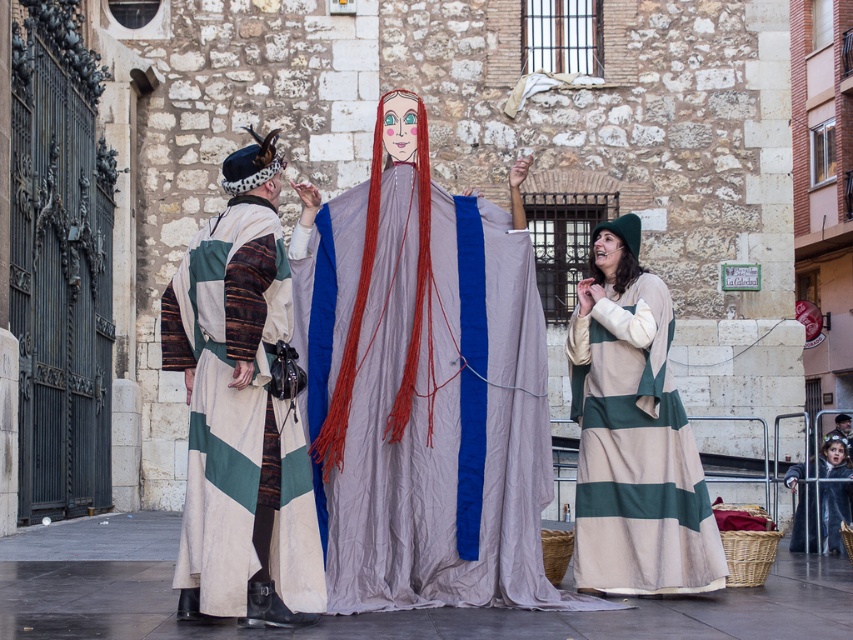
Can you confirm if multicolored woven robe at center is shorter than green striped fabric dress at lower right?

Correct, multicolored woven robe at center is not as tall as green striped fabric dress at lower right.

Is point (247, 234) positioned before point (669, 300)?

Yes, it is in front of point (669, 300).

The height and width of the screenshot is (640, 853). Identify the location of multicolored woven robe at center. (241, 428).

Find the location of a particular element. Image resolution: width=853 pixels, height=640 pixels. multicolored woven robe at center is located at coordinates (241, 428).

Does matte gray fabric at center have a greater height compared to velvet black robe at lower right?

No, matte gray fabric at center is not taller than velvet black robe at lower right.

Does matte gray fabric at center come in front of velvet black robe at lower right?

Yes.

Who is more distant from viewer, (457, 397) or (840, 492)?

The point (840, 492) is behind.

The width and height of the screenshot is (853, 640). Identify the location of matte gray fabric at center. (444, 420).

Is point (525, 276) positioned in front of point (666, 304)?

Yes, it is in front of point (666, 304).

Is matte gray fabric at center thinner than green striped fabric dress at lower right?

Yes.

Who is more forward, (434, 280) or (621, 257)?

Positioned in front is point (434, 280).

Find the location of a particular element. matte gray fabric at center is located at coordinates (444, 420).